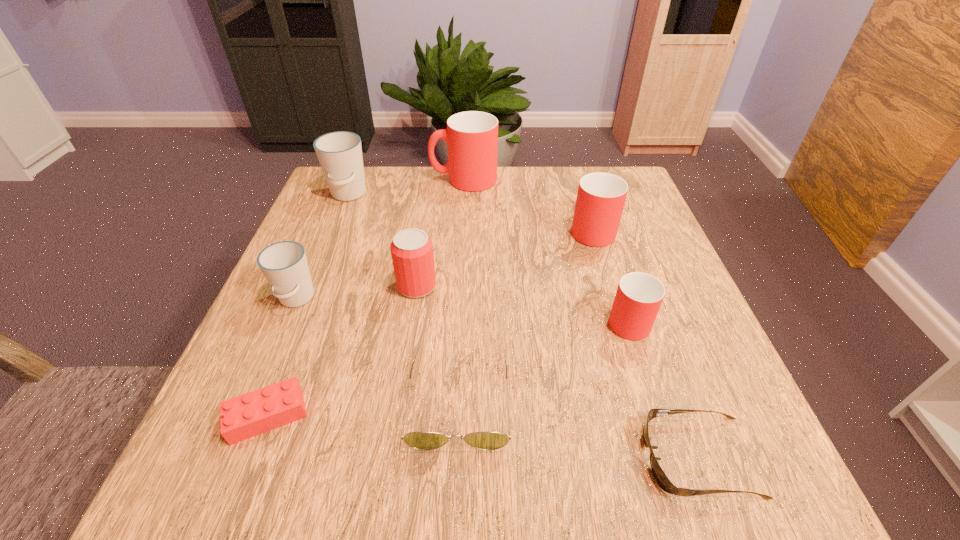
You are a GUI agent. You are given a task and a screenshot of the screen. Output one action in this format:
    pyautogui.click(x=<x>, y=<y>)
    Task: Click on the free spot located 0.090m with a handle on the side of the smaller white cup
    
    Given the screenshot: What is the action you would take?
    pyautogui.click(x=272, y=356)

Identify the location of blank space located 0.170m on the side of the nearest red cup with the handle. (603, 244).

This screenshot has height=540, width=960. I want to click on free space located 0.270m on the side of the nearest red cup with the handle, so click(595, 218).

The width and height of the screenshot is (960, 540). In order to click on free space located 0.200m on the side of the nearest red cup with the handle in this screenshot , I will do `click(601, 236)`.

You are a GUI agent. You are given a task and a screenshot of the screen. Output one action in this format:
    pyautogui.click(x=<x>, y=<y>)
    Task: Click on the vacant space located 0.070m on the front-facing side of the third shortest object
    This screenshot has width=960, height=540.
    Given the screenshot: What is the action you would take?
    pyautogui.click(x=455, y=501)

You are a GUI agent. You are given a task and a screenshot of the screen. Output one action in this format:
    pyautogui.click(x=<x>, y=<y>)
    Task: Click on the free space located on the right of the red Lego
    
    Given the screenshot: What is the action you would take?
    pyautogui.click(x=372, y=416)

Find the location of a particular element. The width and height of the screenshot is (960, 540). free space located on the front-facing side of the shorter sunglasses is located at coordinates (471, 457).

Find the location of a particular element. The height and width of the screenshot is (540, 960). free spot located on the front-facing side of the shorter sunglasses is located at coordinates (548, 457).

You are a GUI agent. You are given a task and a screenshot of the screen. Output one action in this format:
    pyautogui.click(x=<x>, y=<y>)
    Task: Click on the free space located on the front-facing side of the shorter sunglasses
    
    Given the screenshot: What is the action you would take?
    pyautogui.click(x=576, y=457)

Where is `Lego located at the near edge`? Lego located at the near edge is located at coordinates (254, 413).